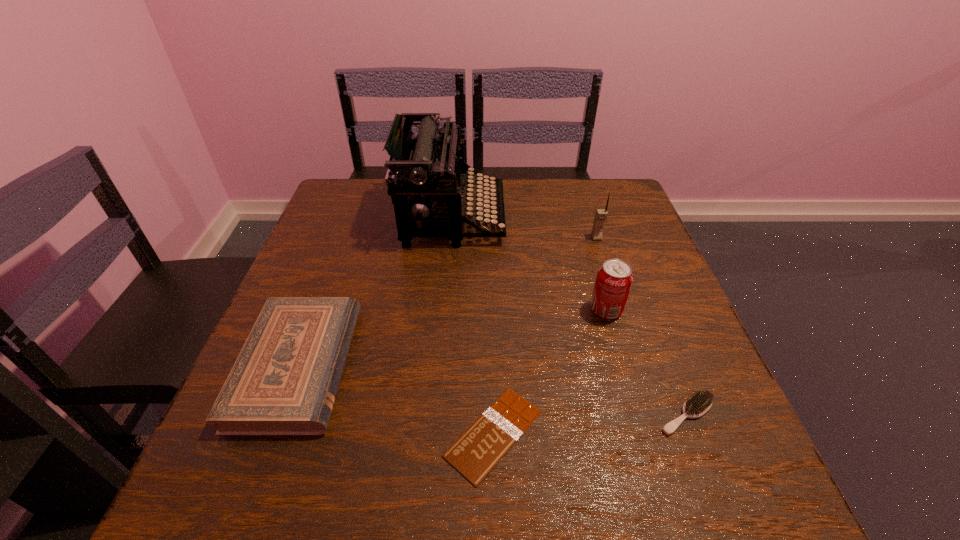
In the image, there is a desktop. At what (x,y) coordinates should I click in order to perform the action: click on free space at the near edge. Please return your answer as a coordinate pair (x, y). The image size is (960, 540). Looking at the image, I should click on (490, 487).

In the image, there is a desktop. Identify the location of vacant space at the right edge. The image size is (960, 540). (630, 235).

The width and height of the screenshot is (960, 540). In order to click on vacant area at the far left corner of the desktop in this screenshot , I will do `click(366, 187)`.

This screenshot has width=960, height=540. In the image, there is a desktop. What are the coordinates of `free region at the near left corner` in the screenshot? It's located at (243, 508).

The width and height of the screenshot is (960, 540). I want to click on vacant area at the far right corner of the desktop, so click(594, 185).

Find the location of `vacant region between the scrubbing brush and the cellular telephone`. vacant region between the scrubbing brush and the cellular telephone is located at coordinates (641, 326).

This screenshot has height=540, width=960. Find the location of `free space between the tallest object and the cellular telephone`. free space between the tallest object and the cellular telephone is located at coordinates (524, 227).

In order to click on free space between the shortest object and the cellular telephone in this screenshot , I will do `click(545, 336)`.

This screenshot has width=960, height=540. Find the location of `free space between the cellular telephone and the shortest object`. free space between the cellular telephone and the shortest object is located at coordinates (545, 336).

Where is `free point between the cellular telephone and the typewriter`? free point between the cellular telephone and the typewriter is located at coordinates (524, 227).